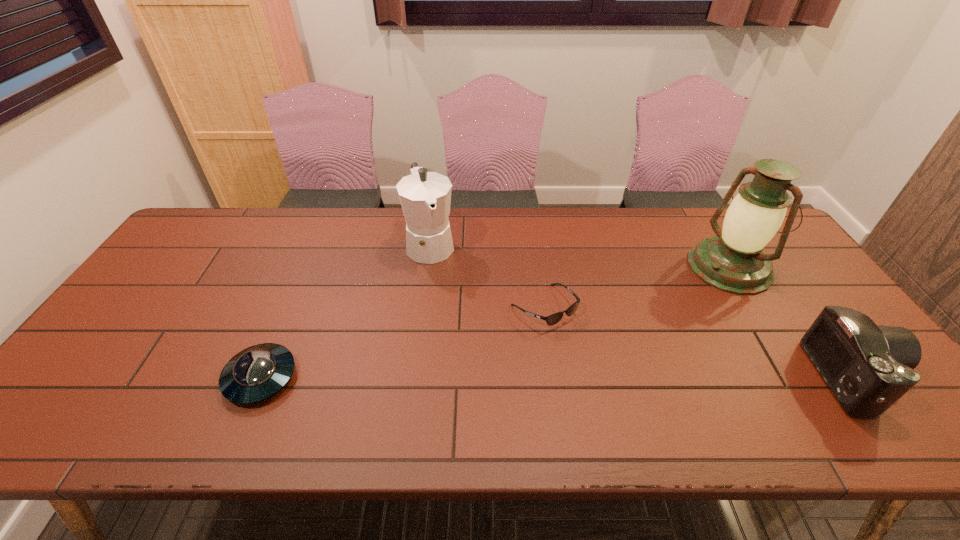
You are a GUI agent. You are given a task and a screenshot of the screen. Output one action in this format:
    pyautogui.click(x=<x>, y=<y>)
    Task: Click on the vacant spot on the desktop that is between the saucer and the third shortest object and is positioned on the front-facing side of the third object from left to right
    This screenshot has height=540, width=960.
    Given the screenshot: What is the action you would take?
    pyautogui.click(x=618, y=377)

The height and width of the screenshot is (540, 960). Identify the location of vacant space on the desktop that is between the leftmost object and the third shortest object and is positioned at the spout of the coffeepot. (485, 377).

Where is `free space on the desktop that is between the saucer and the camera and is positioned with the light compartment facing forward on the tallest object`? This screenshot has width=960, height=540. free space on the desktop that is between the saucer and the camera and is positioned with the light compartment facing forward on the tallest object is located at coordinates (552, 377).